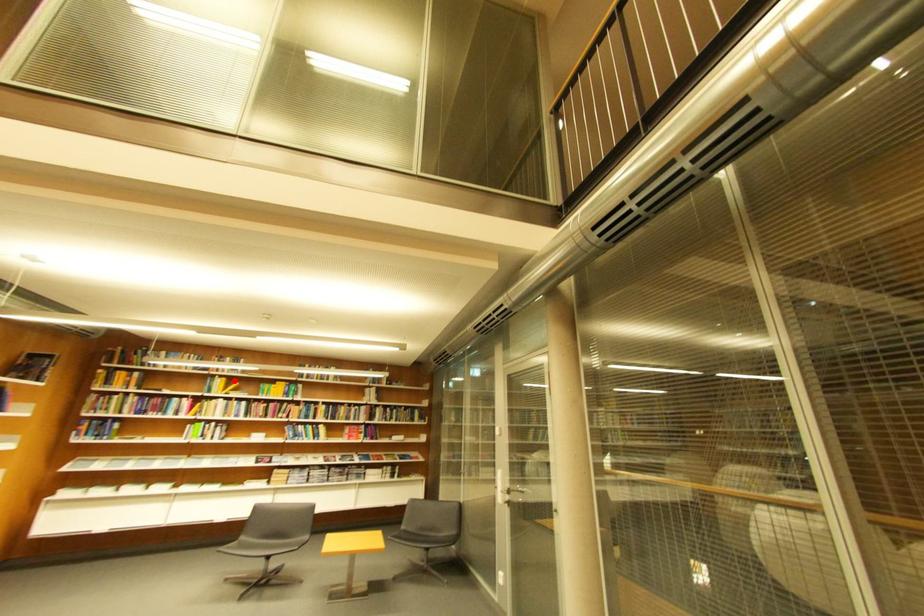
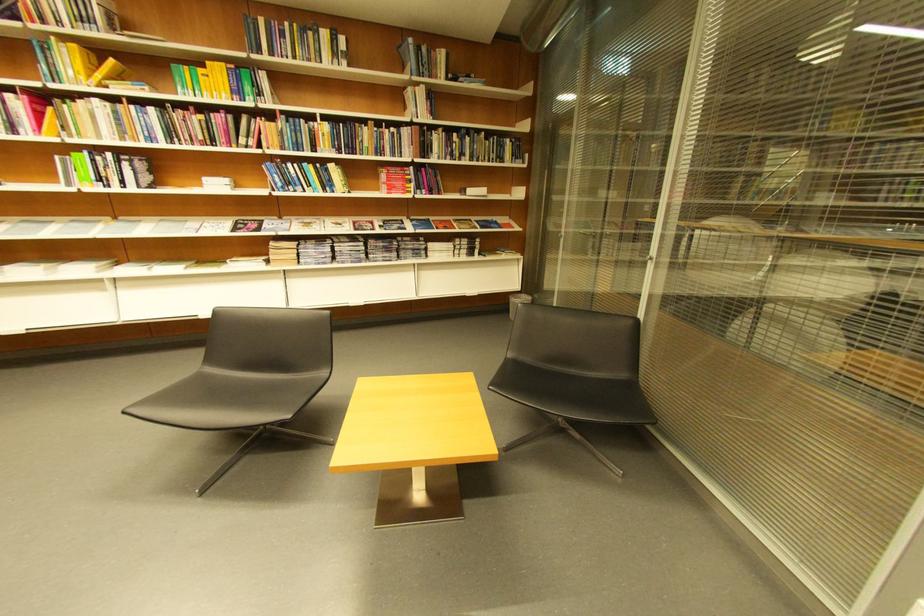
Question: I am providing you with two images of the same scene from different viewpoints. In image1, a red point is highlighted. Considering the same 3D point in image2, which of the following is correct?

Choices:
 (A) It is closer
 (B) It is farther

Answer: (B)